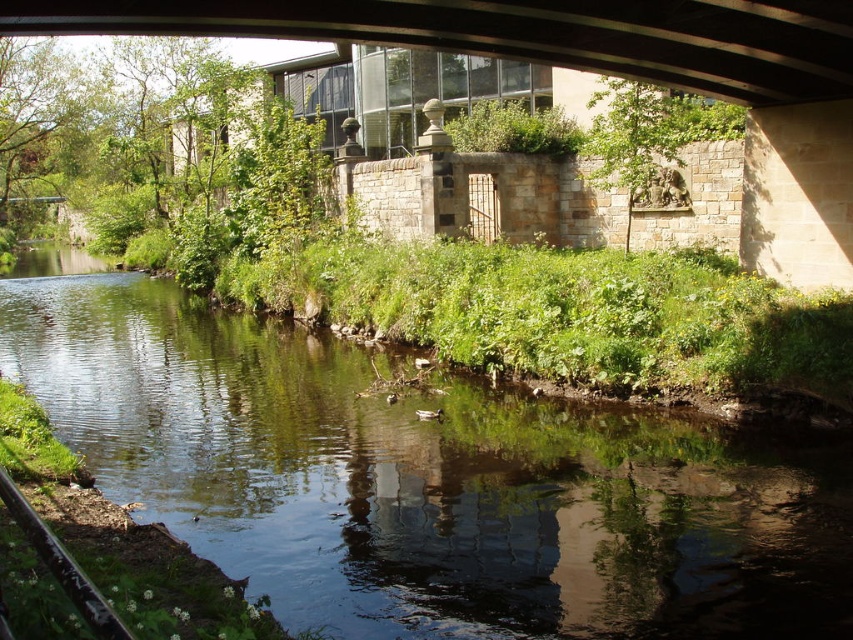
You are standing under the bridge looking at the river. There are two points marked on the river surface. Which point is closer to you, point (3, 284) or point (45, 10)?

Point (45, 10) is closer to you because it is less further to the camera than point (3, 284).

Based on the photo, you are standing on the riverside path and want to cross to the other side. You see the green grassy water at lower left and the glassy concrete bridge at upper center. Which object should you use to cross the river?

You should use the glassy concrete bridge at upper center to cross the river because the green grassy water at lower left is positioned under it, indicating the bridge spans the river and provides a safe crossing.

You are a small boat operator who needs to navigate through the river under the bridge. The boat is 8 meters long. Can you safely pass under the glassy concrete bridge at upper center without hitting the green grassy water at lower left?

The distance between the green grassy water at lower left and the glassy concrete bridge at upper center is 7.68 meters. Since the boat is 8 meters long, it is slightly longer than the available space, so it cannot safely pass under the bridge without hitting the green grassy water at lower left.